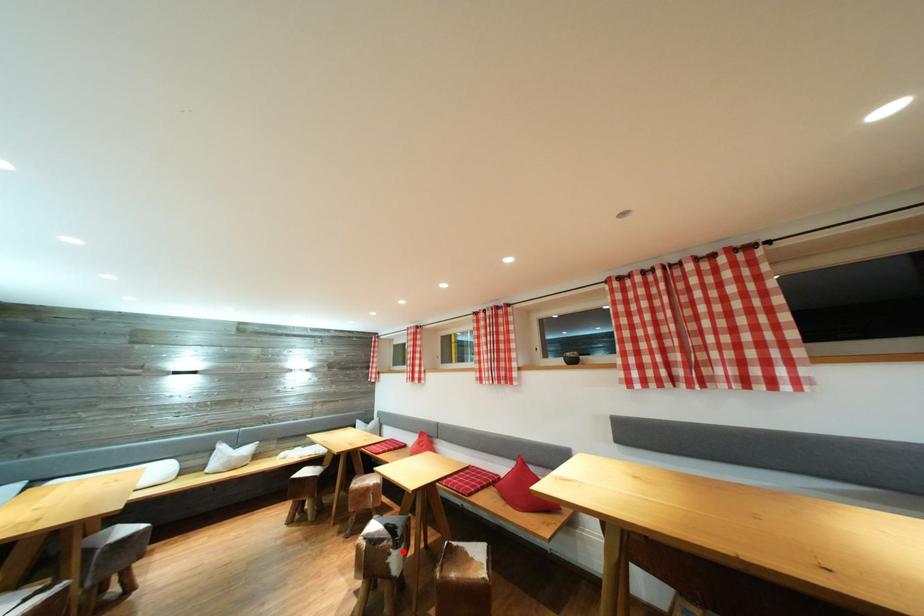
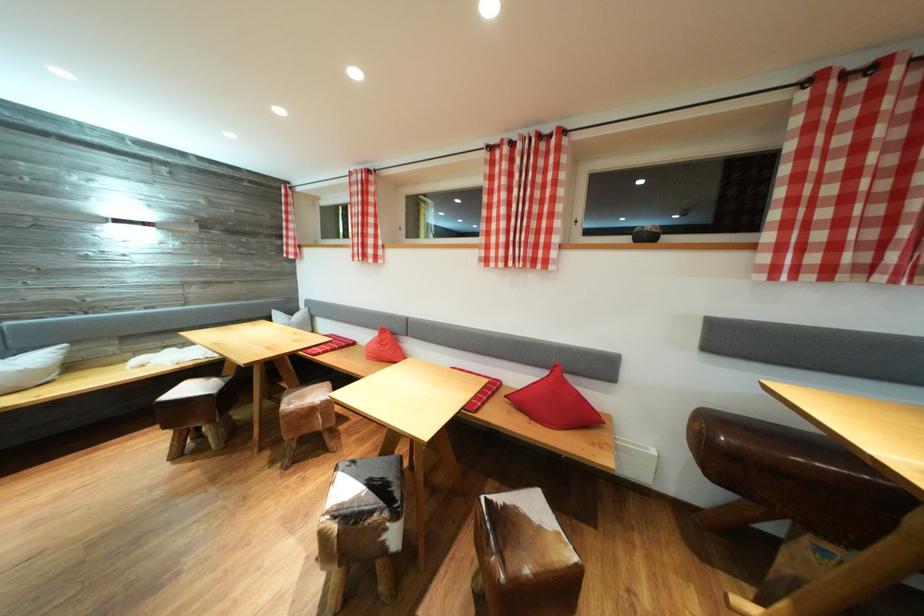
Question: A red point is marked in image1. In image2, is the corresponding 3D point closer to the camera or farther? Reply with the corresponding letter.

Choices:
 (A) The corresponding 3D point is closer.
 (B) The corresponding 3D point is farther.

Answer: (B)